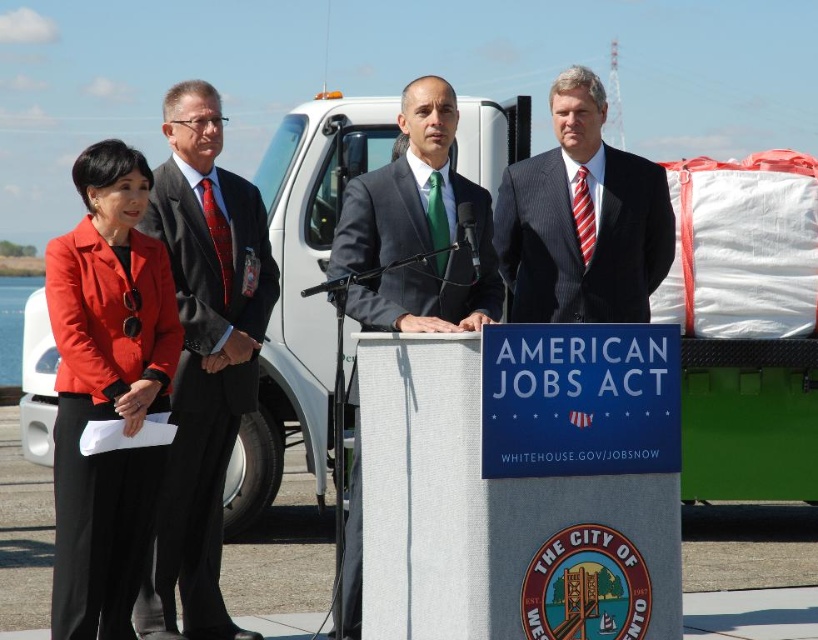
You are attending a formal event and need to locate the speaker who is wearing a matte gray suit at center. From your perspective, which object is directly above the matte red blazer at left?

The matte gray suit at center is directly above the matte red blazer at left.

You are attending a formal event and notice the white matte podium at center and the matte gray suit at center. Based on their positions, which object is located higher?

The matte gray suit at center is higher than the white matte podium at center because the podium is positioned under the suit.